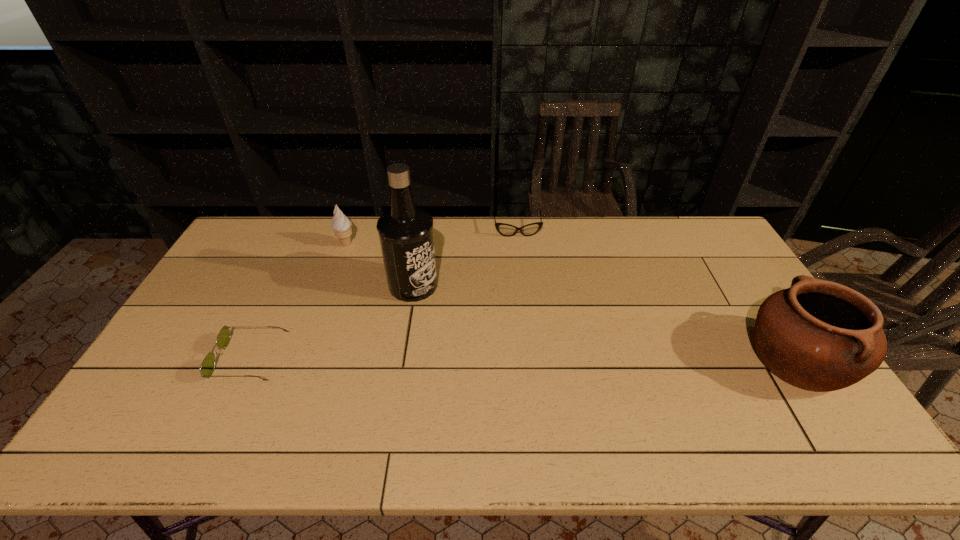
Find the location of a particular element. The height and width of the screenshot is (540, 960). blank space located 0.280m on the front-facing side of the second object from right to left is located at coordinates (527, 292).

You are a GUI agent. You are given a task and a screenshot of the screen. Output one action in this format:
    pyautogui.click(x=<x>, y=<y>)
    Task: Click on the free region located on the front-facing side of the second object from right to left
    
    Given the screenshot: What is the action you would take?
    pyautogui.click(x=524, y=275)

Identify the location of icecream that is at the far edge. This screenshot has height=540, width=960. (341, 225).

Find the location of a particular element. This screenshot has height=540, width=960. spectacles present at the far edge is located at coordinates (507, 230).

Locate an element on the screen. This screenshot has height=540, width=960. sunglasses at the near edge is located at coordinates (207, 367).

Where is `pottery positioned at the near edge`? The image size is (960, 540). pottery positioned at the near edge is located at coordinates (818, 335).

Where is `object that is positioned at the right edge`? The width and height of the screenshot is (960, 540). object that is positioned at the right edge is located at coordinates (818, 335).

Identify the location of object located in the near right corner section of the desktop. (818, 335).

The width and height of the screenshot is (960, 540). In order to click on free space at the far edge in this screenshot , I will do `click(641, 242)`.

Locate an element on the screen. The width and height of the screenshot is (960, 540). free space at the near edge of the desktop is located at coordinates (348, 404).